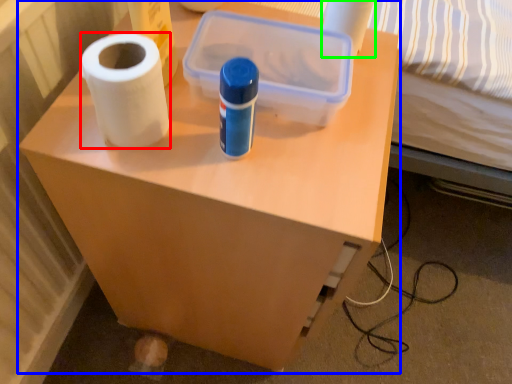
Question: Based on their relative distances, which object is farther from paper towel (highlighted by a red box)? Choose from furniture (highlighted by a blue box) and toilet paper (highlighted by a green box).

Choices:
 (A) furniture
 (B) toilet paper

Answer: (B)